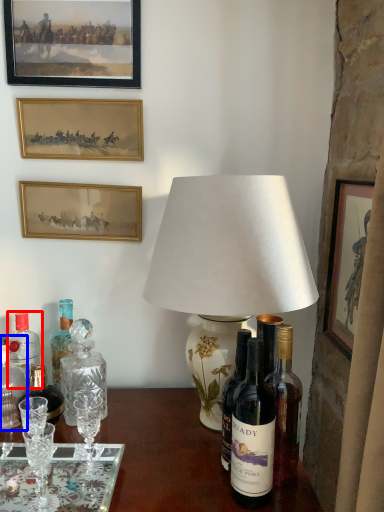
Question: Among these objects, which one is farthest to the camera, bottle (highlighted by a red box) or bottle (highlighted by a blue box)?

Choices:
 (A) bottle
 (B) bottle

Answer: (A)